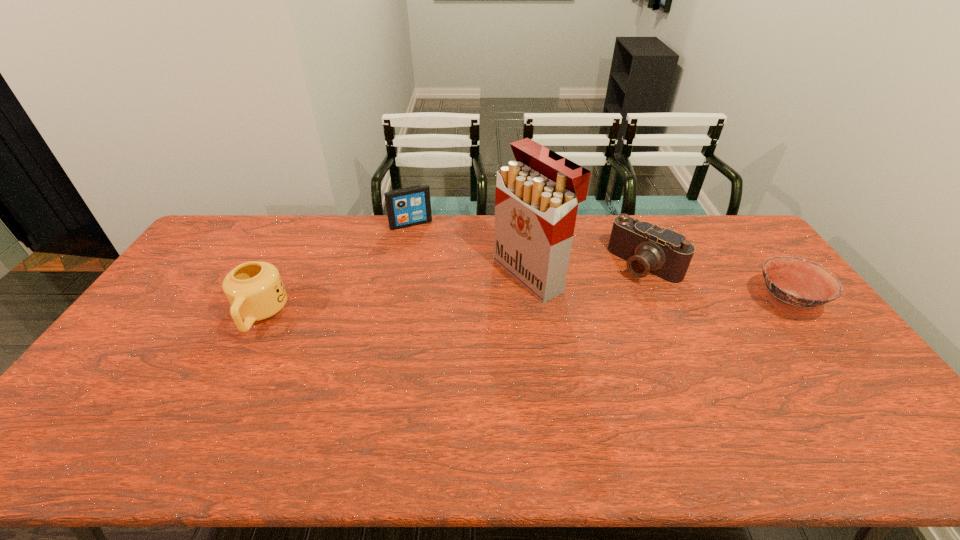
You are a GUI agent. You are given a task and a screenshot of the screen. Output one action in this format:
    pyautogui.click(x=<x>, y=<y>)
    Task: Click on the free space that satisfies the following two spatial constraints: 1. on the front side of the third object from left to right; 2. on the right side of the iPod
    The image size is (960, 540).
    Given the screenshot: What is the action you would take?
    pyautogui.click(x=401, y=274)